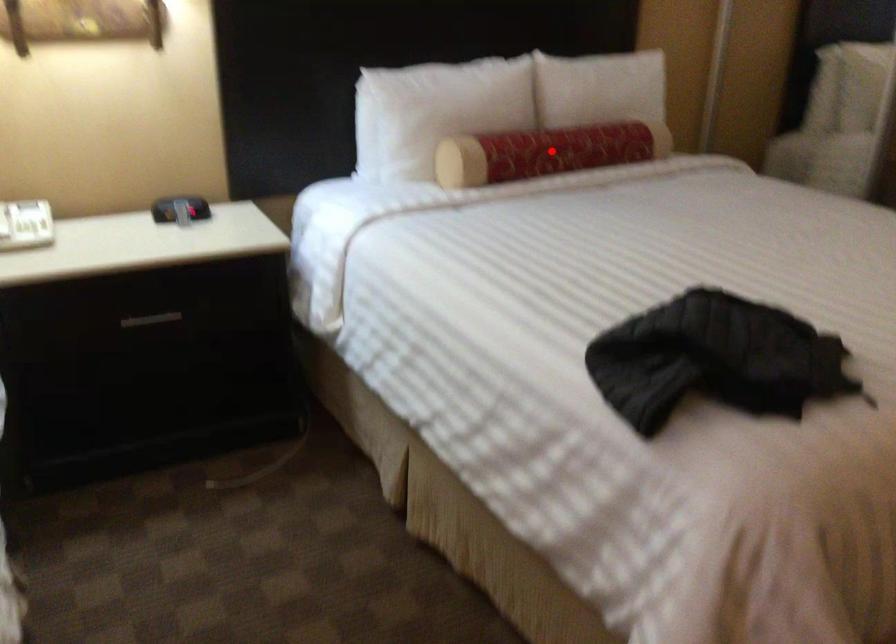
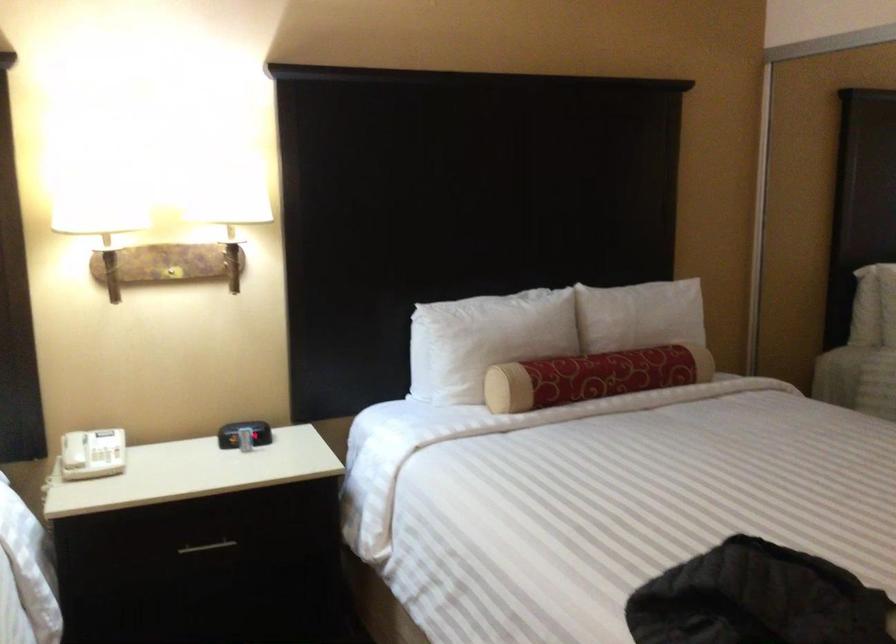
Locate, in the second image, the point that corresponds to the highlighted location in the first image.

(592, 377)